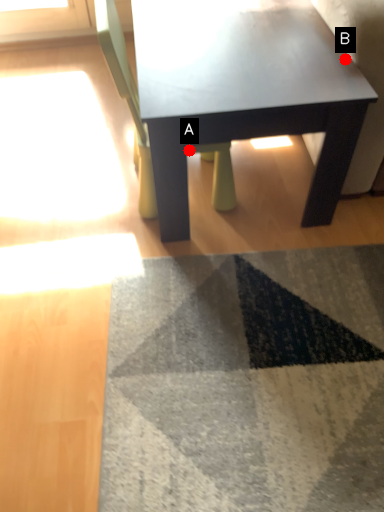
Question: Two points are circled on the image, labeled by A and B beside each circle. Which of the following is the closest to the observer?

Choices:
 (A) A is closer
 (B) B is closer

Answer: (B)